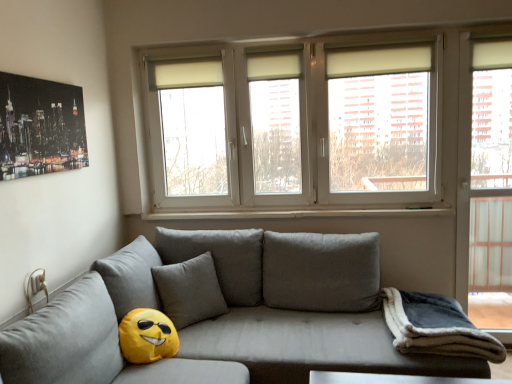
Find the location of a particular element. The height and width of the screenshot is (384, 512). vacant region under white plastic window at upper center (from a real-world perspective) is located at coordinates (298, 211).